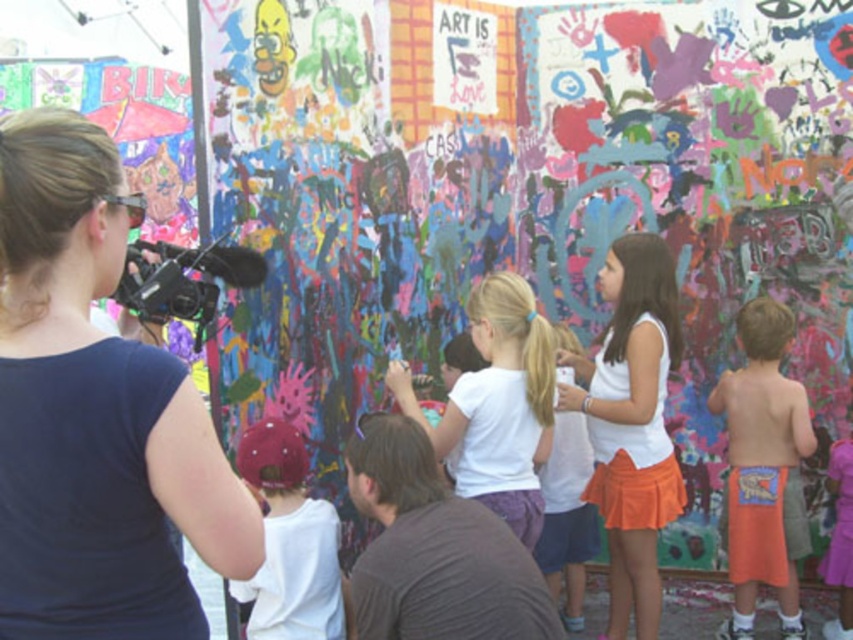
The width and height of the screenshot is (853, 640). In order to click on matte white shirt at lower left in this screenshot , I will do `click(289, 541)`.

How much distance is there between matte white shirt at lower left and pink satin dress at lower right?

matte white shirt at lower left is 77.28 feet away from pink satin dress at lower right.

Who is more forward, (286, 467) or (843, 486)?

Point (286, 467)

The image size is (853, 640). I want to click on matte white shirt at lower left, so click(x=289, y=541).

Which is in front, point (90, 125) or point (274, 540)?

Positioned in front is point (90, 125).

Is dark blue shirt at upper left further to the viewer compared to matte white shirt at lower left?

No, dark blue shirt at upper left is in front of matte white shirt at lower left.

You are a GUI agent. You are given a task and a screenshot of the screen. Output one action in this format:
    pyautogui.click(x=<x>, y=<y>)
    Task: Click on the dark blue shirt at upper left
    The width and height of the screenshot is (853, 640).
    Given the screenshot: What is the action you would take?
    pyautogui.click(x=96, y=416)

Identify the location of dark blue shirt at upper left. (96, 416).

Is white matte tank top at center to the left of matte white shirt at lower left from the viewer's perspective?

In fact, white matte tank top at center is to the right of matte white shirt at lower left.

Which is behind, point (654, 570) or point (289, 522)?

Positioned behind is point (654, 570).

I want to click on white matte tank top at center, so click(x=631, y=422).